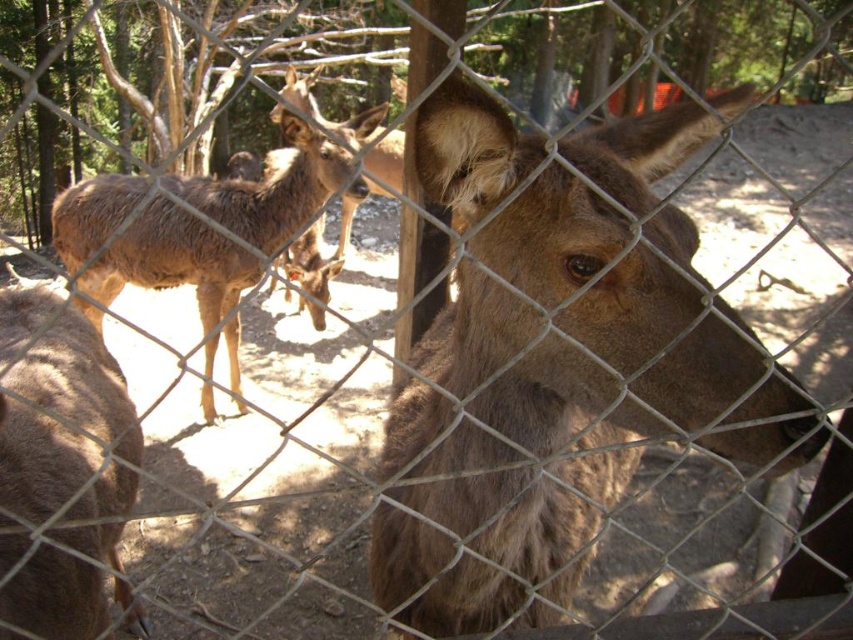
Question: Does brown fuzzy deer at center come behind brown fur deer at center?

Choices:
 (A) yes
 (B) no

Answer: (B)

Question: Does brown fuzzy deer at center have a greater width compared to brown fur deer at center?

Choices:
 (A) yes
 (B) no

Answer: (B)

Question: Among these points, which one is nearest to the camera?

Choices:
 (A) pyautogui.click(x=482, y=180)
 (B) pyautogui.click(x=337, y=260)

Answer: (A)

Question: In this image, where is brown fuzzy deer at center located relative to brown fur deer at center?

Choices:
 (A) below
 (B) above

Answer: (A)